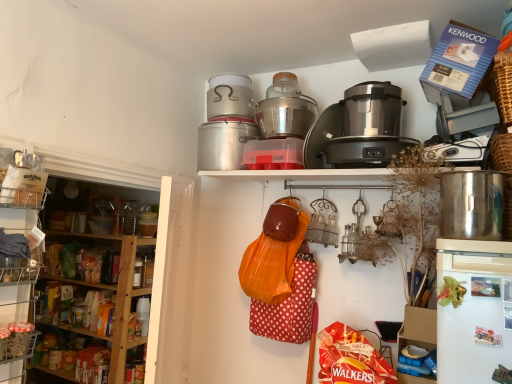
Question: Is silver metallic rice cooker at upper center, the 2th rice cooker when ordered from left to right, in front of or behind wooden shelves at left, which ranks as the second shelf in left-to-right order, in the image?

Choices:
 (A) behind
 (B) front

Answer: (A)

Question: Would you say silver metallic rice cooker at upper center, which is the 2th rice cooker from right to left, is to the left or to the right of wooden shelves at left, which ranks as the second shelf in right-to-left order, in the picture?

Choices:
 (A) right
 (B) left

Answer: (A)

Question: Estimate the real-world distances between objects in this image. Which object is farther from the blue cardboard box at upper right, marked as the 3th appliance in a left-to-right arrangement?

Choices:
 (A) metallic silver toaster at upper right, which appears as the second appliance when viewed from the right
 (B) blue plastic tray at lower right, the first shelf in the right-to-left sequence
 (C) stainless steel pot at right
 (D) clear plastic basket at lower left, acting as the 3th shelf starting from the right
 (E) black plastic food processor at upper center, acting as the first appliance starting from the left

Answer: (D)

Question: Which object is the closest to the clear plastic basket at lower left, which appears as the first shelf when viewed from the left?

Choices:
 (A) satin silver rice cooker at upper center, the 3th rice cooker viewed from the left
 (B) stainless steel pot at right
 (C) blue cardboard box at upper right, marked as the 3th appliance in a left-to-right arrangement
 (D) brushed metal rice cooker at upper center, which ranks as the 3th rice cooker in right-to-left order
 (E) metallic silver toaster at upper right, the 2th appliance from the left

Answer: (D)